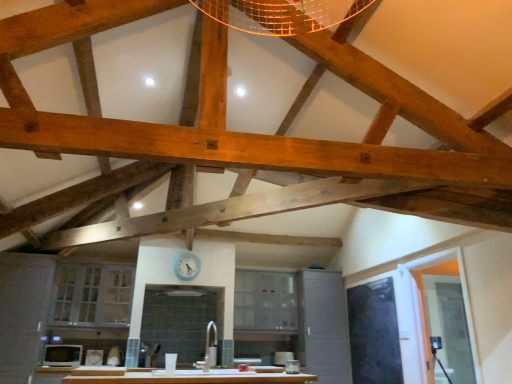
Question: Would you say matte gray cabinet at center, which is the second cabinetry from left to right, contains white glossy sink at center?

Choices:
 (A) no
 (B) yes

Answer: (A)

Question: Does matte gray cabinet at center, which is the second cabinetry from left to right, lie behind white glossy sink at center?

Choices:
 (A) yes
 (B) no

Answer: (A)

Question: Does matte gray cabinet at center, which is the second cabinetry from left to right, appear on the left side of white glossy sink at center?

Choices:
 (A) no
 (B) yes

Answer: (A)

Question: Is matte gray cabinet at center, which is the 2th cabinetry in right-to-left order, far from white glossy sink at center?

Choices:
 (A) yes
 (B) no

Answer: (B)

Question: Is matte gray cabinet at center, which is the 2th cabinetry in right-to-left order, thinner than white glossy sink at center?

Choices:
 (A) no
 (B) yes

Answer: (B)

Question: Is matte gray cabinet at center, which is the 2th cabinetry in right-to-left order, taller than white glossy sink at center?

Choices:
 (A) yes
 (B) no

Answer: (A)

Question: From a real-world perspective, is matte gray cabinet at center, which is counted as the 3th cabinetry, starting from the left, physically below white glossy sink at center?

Choices:
 (A) no
 (B) yes

Answer: (A)

Question: Can you confirm if matte gray cabinet at center, arranged as the 1th cabinetry when viewed from the right, is positioned to the left of white glossy sink at center?

Choices:
 (A) no
 (B) yes

Answer: (A)

Question: Is matte gray cabinet at center, which is counted as the 3th cabinetry, starting from the left, not within white glossy sink at center?

Choices:
 (A) no
 (B) yes

Answer: (B)

Question: Is the position of matte gray cabinet at center, which is counted as the 3th cabinetry, starting from the left, less distant than that of white glossy sink at center?

Choices:
 (A) no
 (B) yes

Answer: (A)

Question: From the image's perspective, is matte gray cabinet at center, arranged as the 1th cabinetry when viewed from the right, below white glossy sink at center?

Choices:
 (A) no
 (B) yes

Answer: (B)

Question: Can you confirm if matte gray cabinet at center, arranged as the 1th cabinetry when viewed from the right, is taller than white glossy sink at center?

Choices:
 (A) yes
 (B) no

Answer: (A)

Question: Is matte white microwave at lower left oriented towards white glass cabinet at lower left, positioned as the third cabinetry in right-to-left order?

Choices:
 (A) no
 (B) yes

Answer: (A)